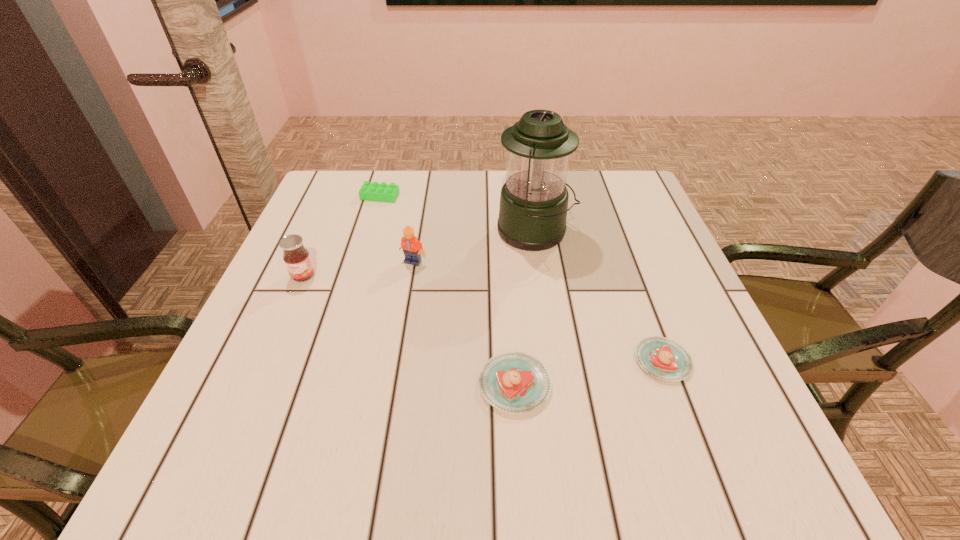
You are a GUI agent. You are given a task and a screenshot of the screen. Output one action in this format:
    pyautogui.click(x=<x>, y=<y>)
    Task: Click on the jam located at the left edge
    Image resolution: width=960 pixels, height=540 pixels.
    Given the screenshot: What is the action you would take?
    pyautogui.click(x=296, y=257)

This screenshot has height=540, width=960. Identify the location of object present at the right edge. click(660, 357).

You are a GUI agent. You are given a task and a screenshot of the screen. Output one action in this format:
    pyautogui.click(x=<x>, y=<y>)
    Task: Click on the object positioned at the far left corner
    Image resolution: width=960 pixels, height=540 pixels.
    Given the screenshot: What is the action you would take?
    pyautogui.click(x=383, y=192)

Where is `object present at the near right corner`? object present at the near right corner is located at coordinates (660, 357).

In order to click on free space at the far edge in this screenshot , I will do `click(449, 175)`.

In the image, there is a desktop. Where is `free space at the near edge`? Image resolution: width=960 pixels, height=540 pixels. free space at the near edge is located at coordinates (465, 410).

At what (x,y) coordinates should I click in order to perform the action: click on vacant space at the left edge of the desktop. Please return your answer as a coordinate pair (x, y). Looking at the image, I should click on (311, 333).

Where is `free space at the right edge of the desktop`? This screenshot has height=540, width=960. free space at the right edge of the desktop is located at coordinates (692, 348).

Where is `vacant space at the far left corner of the desktop`? The height and width of the screenshot is (540, 960). vacant space at the far left corner of the desktop is located at coordinates (339, 215).

The image size is (960, 540). In order to click on vacant area at the far right corner in this screenshot , I will do `click(604, 204)`.